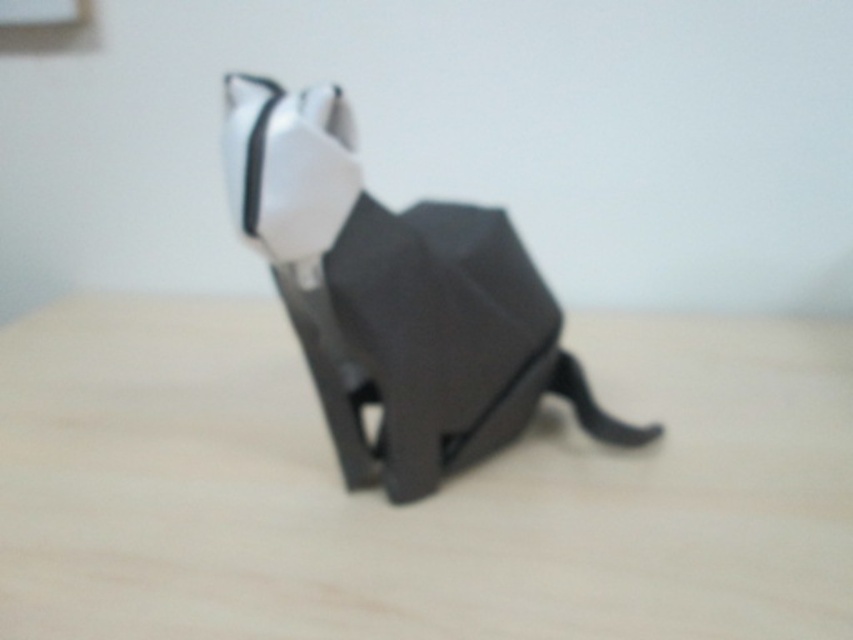
You are an artist holding a 12 inch ruler. You want to place it on the wooden table at center. Can you fit the ruler entirely on the table without overhanging?

The wooden table at center is 31.43 inches from viewer. Since the ruler is 12 inches long, and the table is longer than that, you can fit the ruler entirely on the table without overhanging.

You are organizing a small exhibition and need to place a decorative item on the wooden table at center. However, there is already a white matte bow tie at center on it. Can you place the new item without moving the bow tie?

The wooden table at center is below the white matte bow tie at center, which means the bow tie is placed on top of the table. Therefore, you can place the new item on the wooden table at center as long as there is enough space beside the existing bow tie.